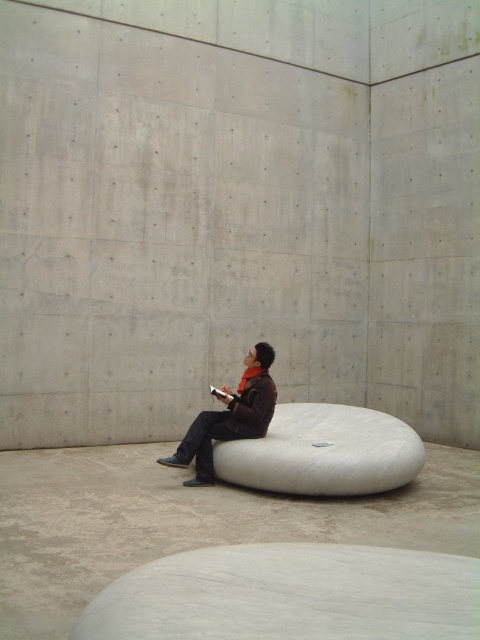
Based on the photo, which is more to the right, white matte bean bag chair at center or dark brown leather jacket at center?

From the viewer's perspective, white matte bean bag chair at center appears more on the right side.

Which is below, white matte bean bag chair at center or dark brown leather jacket at center?

white matte bean bag chair at center

The height and width of the screenshot is (640, 480). I want to click on white matte bean bag chair at center, so click(324, 452).

Does white smooth concrete at center appear on the right side of white matte bean bag chair at center?

Incorrect, white smooth concrete at center is not on the right side of white matte bean bag chair at center.

Which of these two, white smooth concrete at center or white matte bean bag chair at center, stands shorter?

Standing shorter between the two is white smooth concrete at center.

Locate an element on the screen. The image size is (480, 640). white smooth concrete at center is located at coordinates (187, 522).

Locate an element on the screen. The height and width of the screenshot is (640, 480). white smooth concrete at center is located at coordinates (187, 522).

Which is more to the right, white smooth concrete at center or dark brown leather jacket at center?

Positioned to the right is white smooth concrete at center.

Is white smooth concrete at center further to the viewer compared to dark brown leather jacket at center?

No.

Between point (117, 538) and point (201, 484), which one is positioned in front?

Point (117, 538) is more forward.

Locate an element on the screen. white smooth concrete at center is located at coordinates (187, 522).